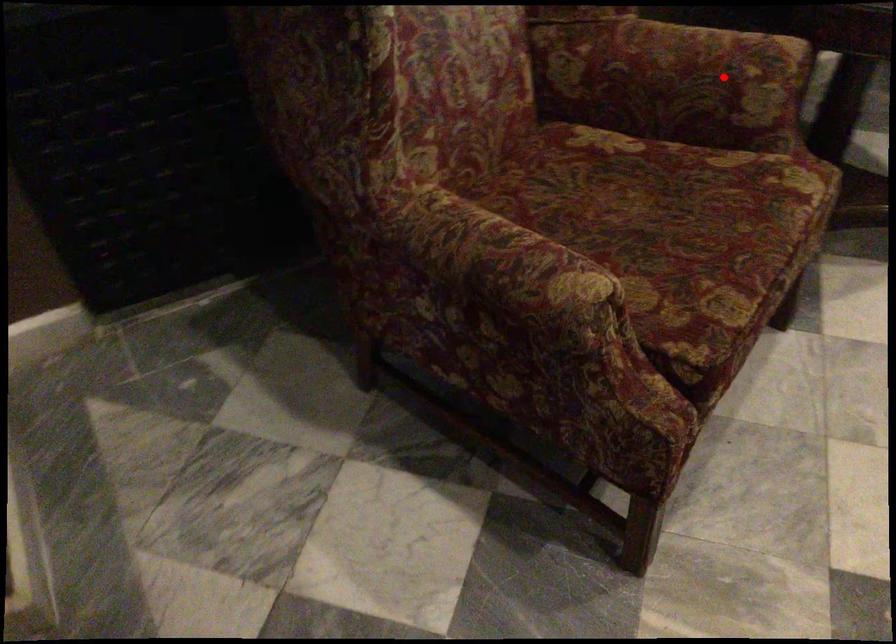
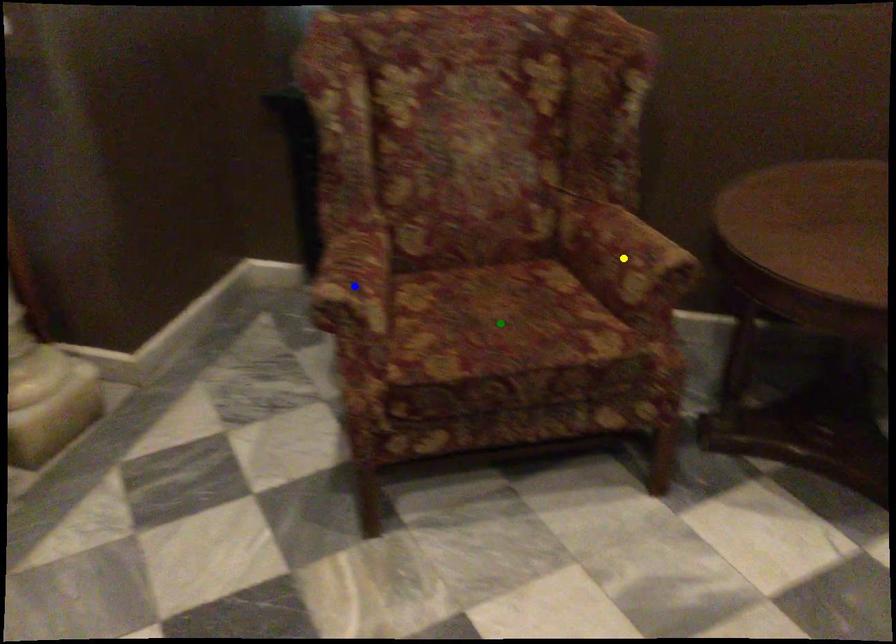
Question: I am providing you with two images of the same scene from different viewpoints. A red point is marked on the first image. You are given multiple points on the second image. Which spot in image 2 lines up with the point in image 1?

Choices:
 (A) blue point
 (B) yellow point
 (C) green point

Answer: (B)